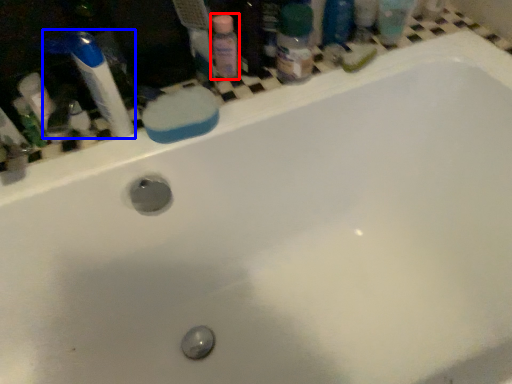
Question: Which point is further to the camera, cleaning product (highlighted by a red box) or toothbrush (highlighted by a blue box)?

Choices:
 (A) cleaning product
 (B) toothbrush

Answer: (A)